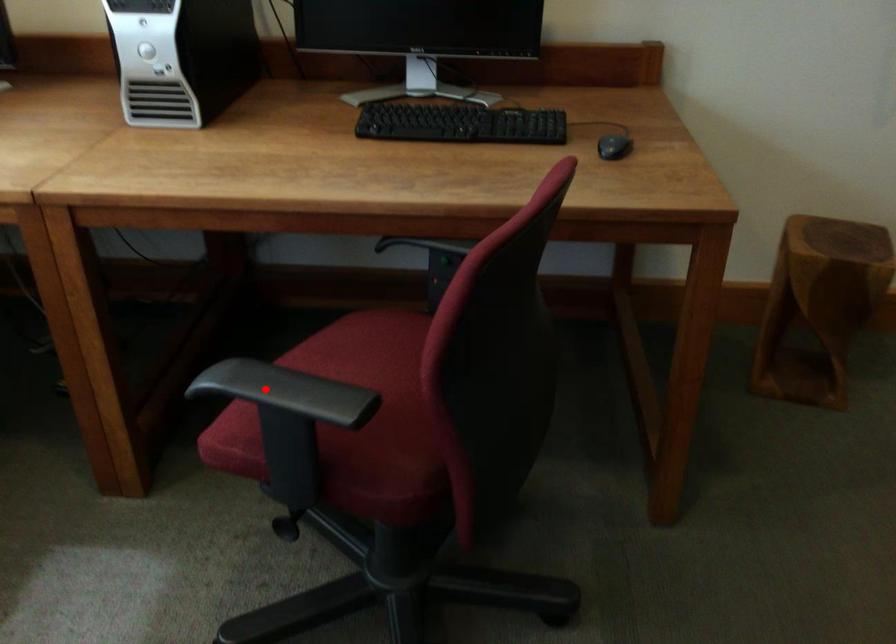
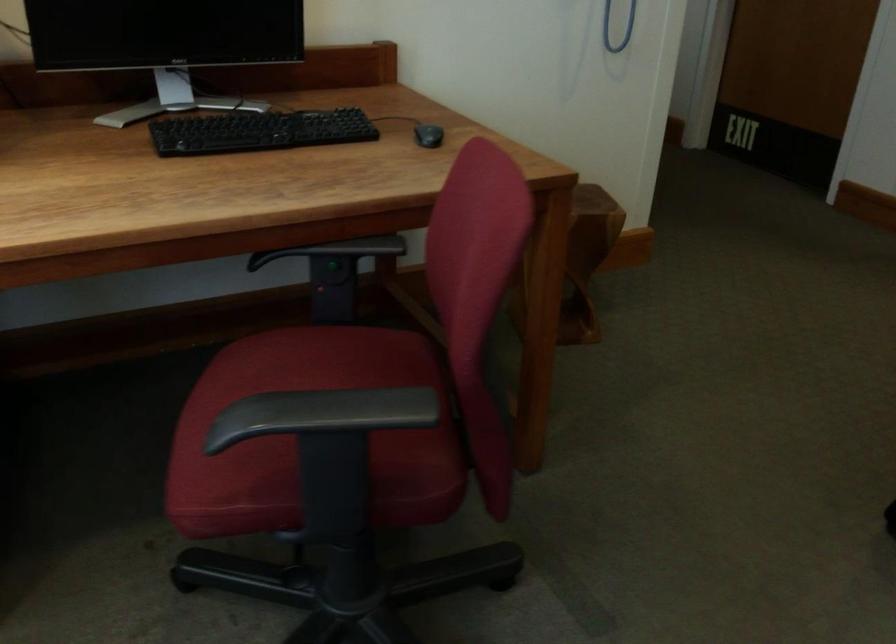
Where in the second image is the point corresponding to the highlighted location from the first image?

(321, 413)